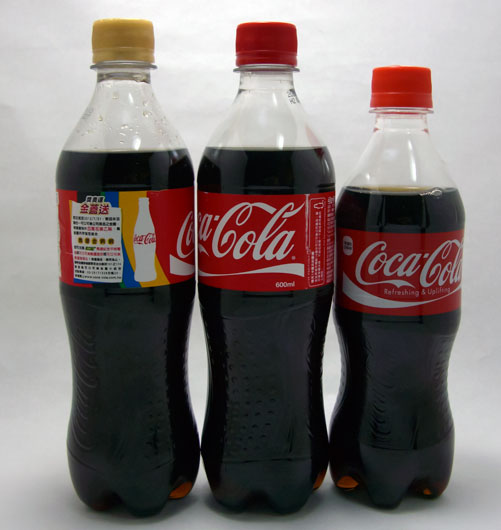
Identify the location of bottle. This screenshot has width=501, height=530. (153, 236), (126, 113), (253, 111), (392, 156).